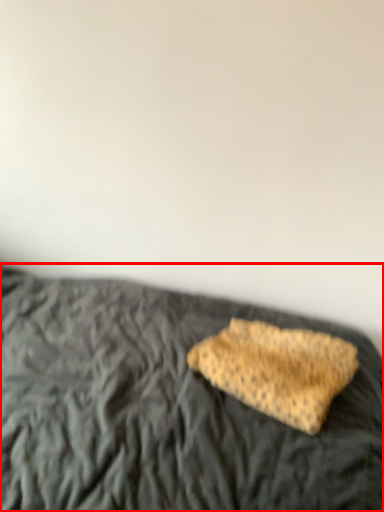
Question: Considering the relative positions of bed (annotated by the red box) and sponge in the image provided, where is bed (annotated by the red box) located with respect to the staircase?

Choices:
 (A) left
 (B) right

Answer: (A)